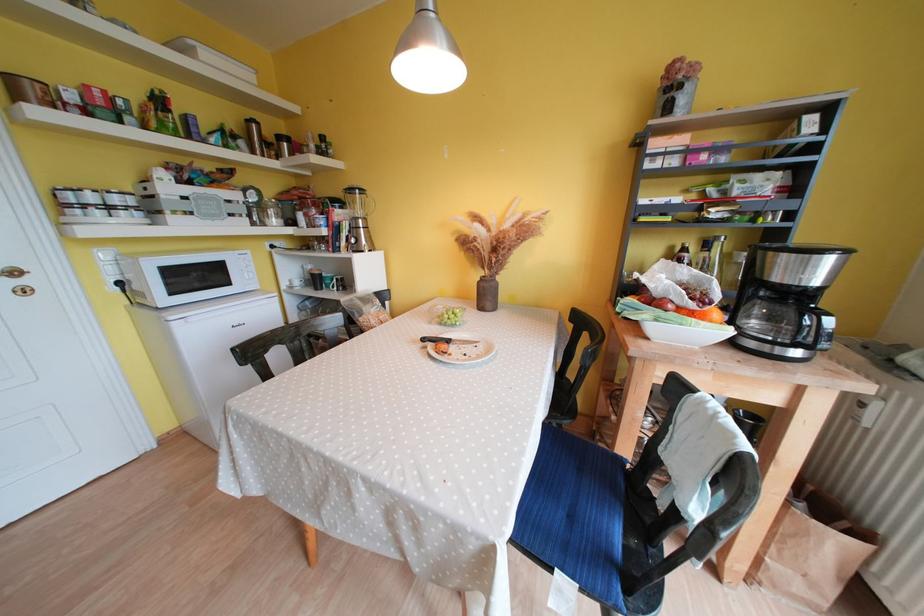
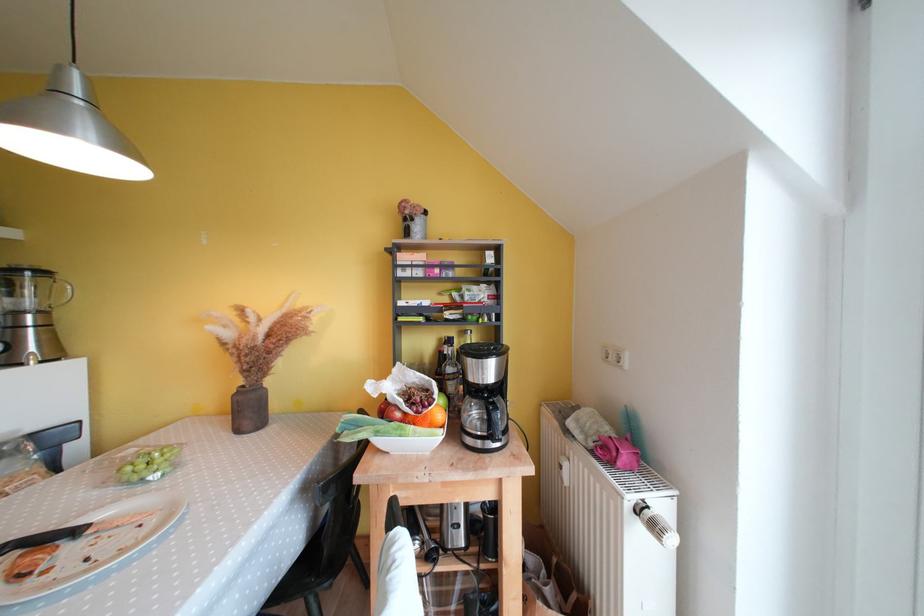
In the second image, find the point that corresponds to point (821, 276) in the first image.

(494, 376)